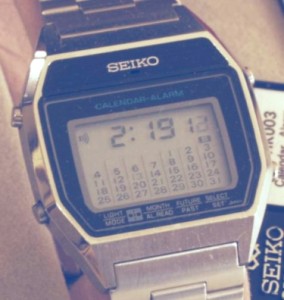
Where is `floor`? This screenshot has height=300, width=284. floor is located at coordinates (30, 261).